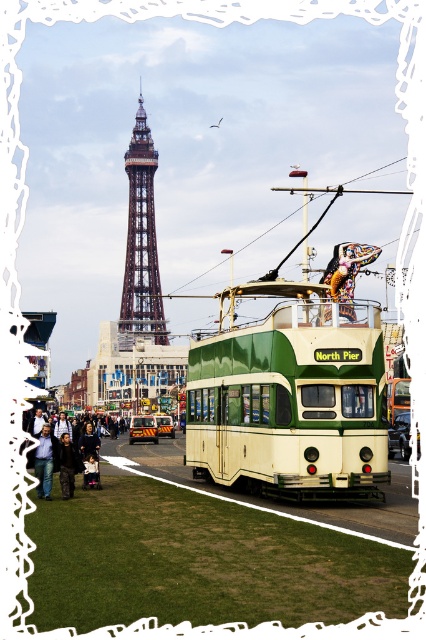
Is brown wooden tower at center shorter than jeans at lower left?

No, brown wooden tower at center is not shorter than jeans at lower left.

Who is taller, brown wooden tower at center or jeans at lower left?

brown wooden tower at center is taller.

Is point (152, 163) farther from camera compared to point (46, 449)?

Yes, point (152, 163) is behind point (46, 449).

Where is `brown wooden tower at center`? brown wooden tower at center is located at coordinates (141, 243).

Is point (158, 285) closer to viewer compared to point (69, 461)?

No, (158, 285) is further to viewer.

What do you see at coordinates (141, 243) in the screenshot? The image size is (426, 640). I see `brown wooden tower at center` at bounding box center [141, 243].

At what (x,y) coordinates should I click in order to perform the action: click on brown wooden tower at center. Please return your answer as a coordinate pair (x, y). The height and width of the screenshot is (640, 426). Looking at the image, I should click on (141, 243).

Does point (259, 467) come behind point (69, 445)?

No, it is in front of (69, 445).

Is green matte/deck bus at center thinner than dark blue leather jacket at lower left?

In fact, green matte/deck bus at center might be wider than dark blue leather jacket at lower left.

At what (x,y) coordinates should I click in order to perform the action: click on green matte/deck bus at center. Please return your answer as a coordinate pair (x, y). This screenshot has width=426, height=640. Looking at the image, I should click on (290, 403).